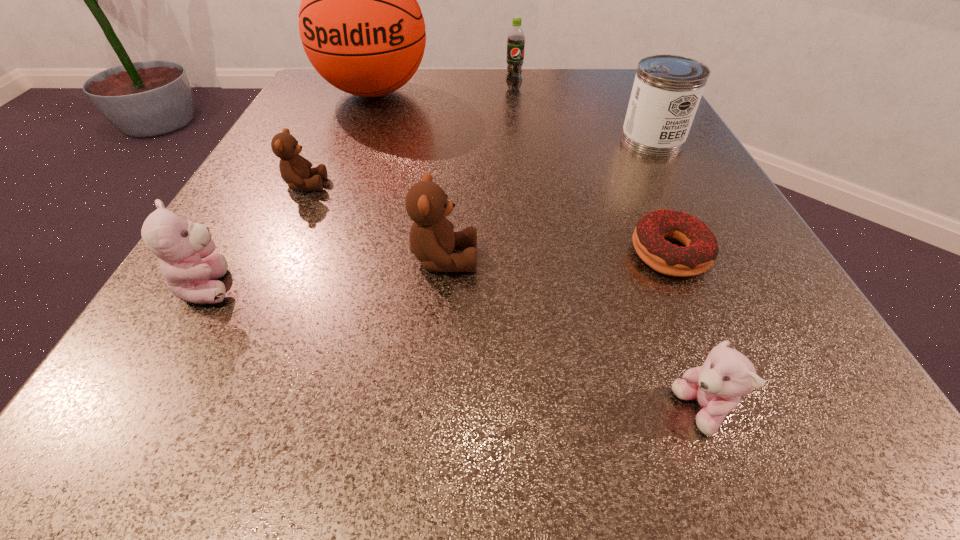
Image resolution: width=960 pixels, height=540 pixels. In order to click on vacant space situated at the face of the right pink teddy bear in this screenshot , I will do pyautogui.click(x=467, y=411).

Locate an element on the screen. The width and height of the screenshot is (960, 540). vacant space situated at the face of the right pink teddy bear is located at coordinates [357, 411].

Locate an element on the screen. The height and width of the screenshot is (540, 960). vacant point located 0.110m at the face of the right pink teddy bear is located at coordinates (565, 411).

In order to click on free location located on the front of the shortest object in this screenshot , I will do `click(721, 369)`.

Image resolution: width=960 pixels, height=540 pixels. Find the location of `basketball at the far edge`. basketball at the far edge is located at coordinates (361, 27).

In order to click on soda present at the far edge in this screenshot , I will do `click(516, 39)`.

This screenshot has width=960, height=540. I want to click on object positioned at the near edge, so click(x=726, y=375).

I want to click on basketball situated at the left edge, so click(361, 27).

Identify the location of can situated at the right edge. The image size is (960, 540). (667, 89).

At what (x,y) coordinates should I click in order to perform the action: click on teddy bear that is at the right edge. Please return your answer as a coordinate pair (x, y). Image resolution: width=960 pixels, height=540 pixels. Looking at the image, I should click on (726, 375).